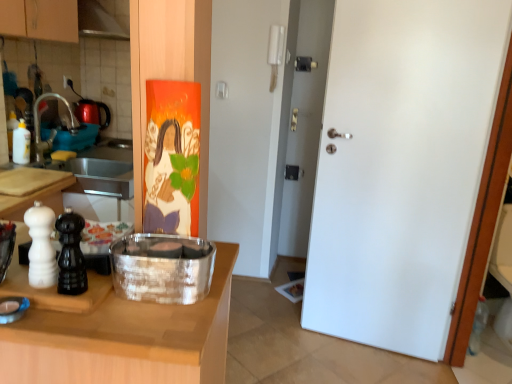
Question: Does point (56, 196) appear closer or farther from the camera than point (20, 145)?

Choices:
 (A) closer
 (B) farther

Answer: (A)

Question: Considering the positions of wooden cutting board at left, marked as the second countertop in a bottom-to-top arrangement, and white glossy bottle at left in the image, is wooden cutting board at left, marked as the second countertop in a bottom-to-top arrangement, wider or thinner than white glossy bottle at left?

Choices:
 (A) thin
 (B) wide

Answer: (B)

Question: Which object is positioned closest to the wooden cutting board at left, which appears as the 2th countertop when viewed from the top?

Choices:
 (A) wooden cutting board at left, marked as the 1th countertop in a top-to-bottom arrangement
 (B) silver metallic container at center
 (C) white glossy bottle at left
 (D) brushed metal faucet at left

Answer: (B)

Question: Which object is positioned farthest from the wooden cutting board at left, marked as the second countertop in a bottom-to-top arrangement?

Choices:
 (A) white glossy bottle at left
 (B) wooden cutting board at left, marked as the 1th countertop in a bottom-to-top arrangement
 (C) silver metallic container at center
 (D) brushed metal faucet at left

Answer: (B)